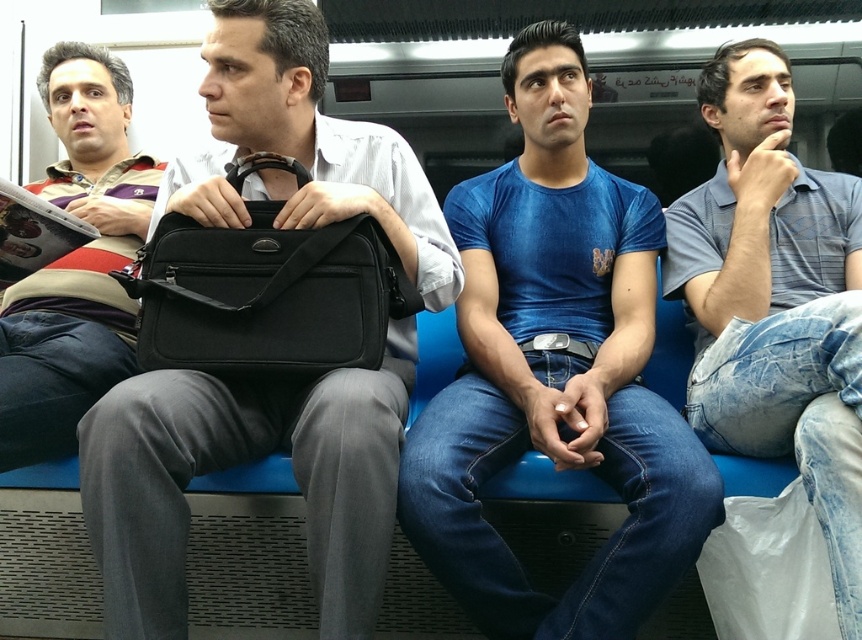
You are a passenger on the train and want to place your new backpack between the black fabric briefcase at center and the striped sweater at left. Can you fit it there?

The black fabric briefcase at center occupies less space than the striped sweater at left, so there might not be enough space between them to fit your backpack.

You are standing on the train and want to know if you can safely walk between the blue denim jeans at center and the striped sweater at left without stepping too close. The minimum safe distance required is 36 inches. Can you walk between them?

The blue denim jeans at center is 37.81 inches away from the striped sweater at left, which is greater than the minimum safe distance of 36 inches. Therefore, you can safely walk between them.